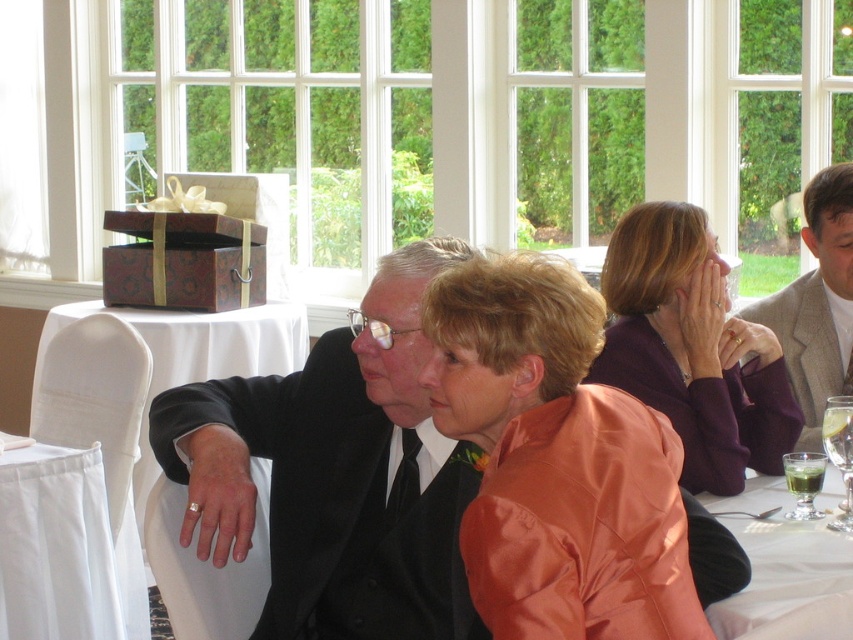
Looking at this image, you are a waiter at this event and need to place a new drink order on the table. The satin orange jacket at center is currently blocking access to the clear glass wine glass at lower right. Can you move the jacket to the side to access the glass?

The satin orange jacket at center is in front of the clear glass wine glass at lower right, so you can move the jacket aside to access the glass.

You are a waiter at a wedding reception and you need to serve a drink that requires a taller glass. Which glass should you choose between the clear glass at lower right and the green translucent glass at lower right?

The clear glass at lower right has a greater height compared to the green translucent glass at lower right, so you should choose the clear glass at lower right.